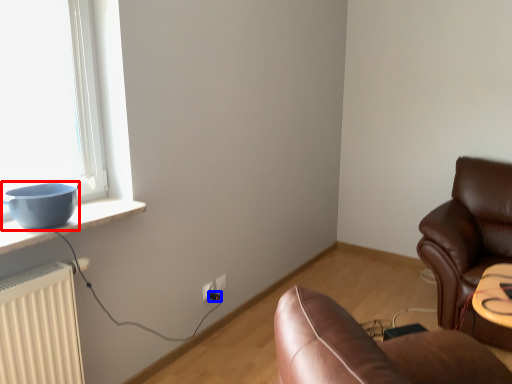
Question: Which point is further to the camera, bowl (highlighted by a red box) or plug (highlighted by a blue box)?

Choices:
 (A) bowl
 (B) plug

Answer: (B)